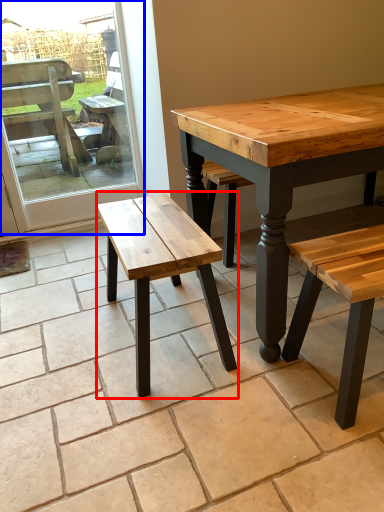
Question: Which of the following is the farthest to the observer, stool (highlighted by a red box) or screen door (highlighted by a blue box)?

Choices:
 (A) stool
 (B) screen door

Answer: (B)